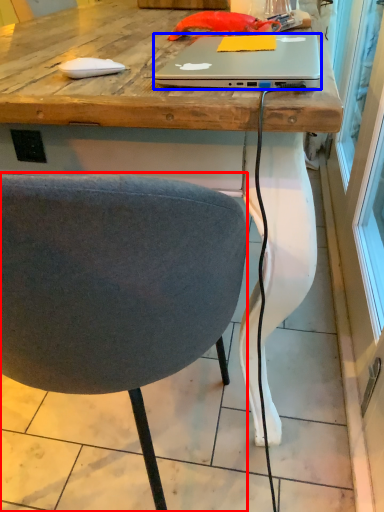
Question: Which point is further to the camera, chair (highlighted by a red box) or laptop (highlighted by a blue box)?

Choices:
 (A) chair
 (B) laptop

Answer: (B)